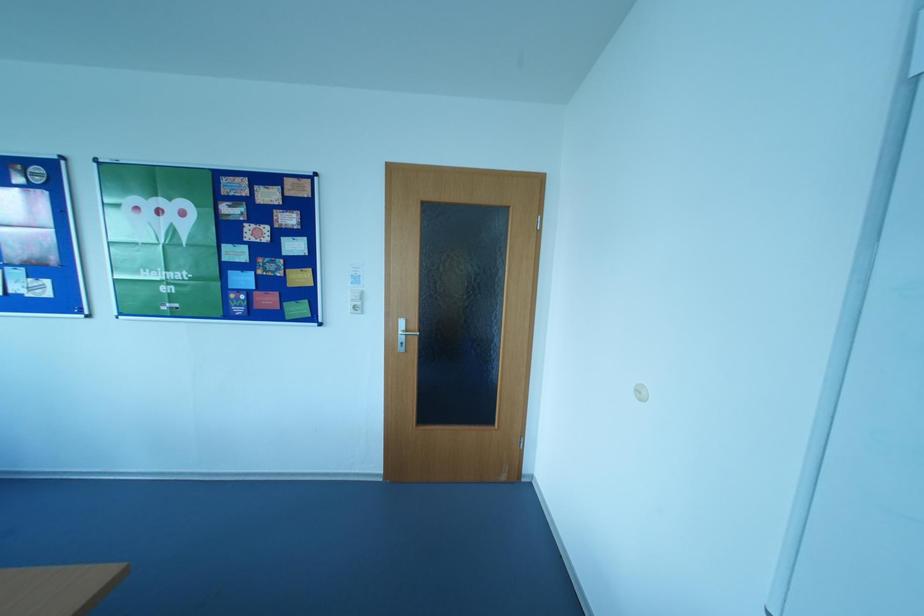
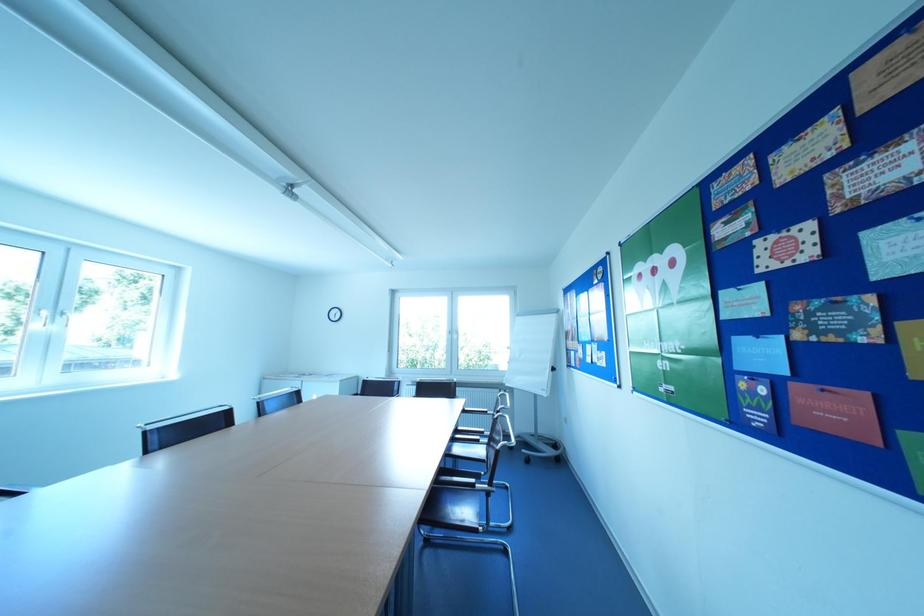
Question: The images are taken continuously from a first-person perspective. In which direction is your viewpoint rotating?

Choices:
 (A) Left
 (B) Right
 (C) Up
 (D) Down

Answer: (A)